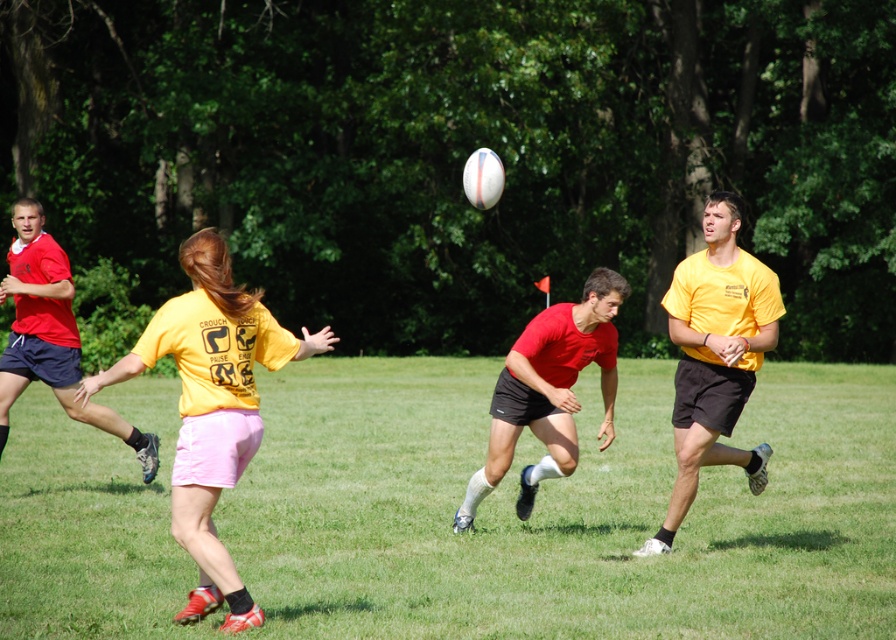
Which is behind, point (142, 340) or point (748, 477)?

Point (748, 477)

Which is in front, point (208, 444) or point (720, 234)?

Point (208, 444) is more forward.

The image size is (896, 640). What do you see at coordinates (212, 406) in the screenshot?
I see `yellow matte shirt at center` at bounding box center [212, 406].

What are the coordinates of `yellow matte shirt at center` in the screenshot? It's located at (212, 406).

Can you confirm if yellow matte shirt at right is positioned to the left of matte red shorts at center?

In fact, yellow matte shirt at right is to the right of matte red shorts at center.

Find the location of a particular element. This screenshot has width=896, height=640. yellow matte shirt at right is located at coordinates (714, 355).

Can you confirm if yellow matte shirt at center is positioned to the left of matte red shorts at center?

Correct, you'll find yellow matte shirt at center to the left of matte red shorts at center.

Does yellow matte shirt at center appear under matte red shorts at center?

No, yellow matte shirt at center is not below matte red shorts at center.

Which is in front, point (240, 429) or point (604, 408)?

Point (240, 429) is in front.

Find the location of `yellow matte shirt at center`. yellow matte shirt at center is located at coordinates (212, 406).